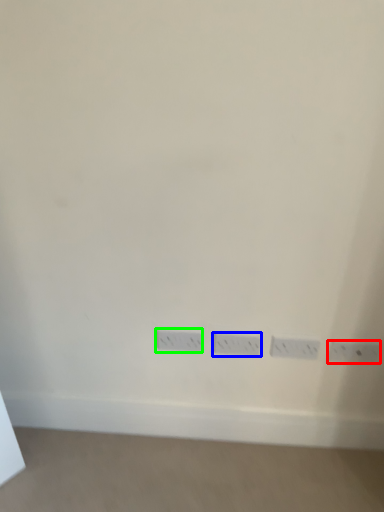
Question: Which object is positioned closest to power plugs and sockets (highlighted by a red box)? Select from power plugs and sockets (highlighted by a blue box) and power plugs and sockets (highlighted by a green box).

Choices:
 (A) power plugs and sockets
 (B) power plugs and sockets

Answer: (A)